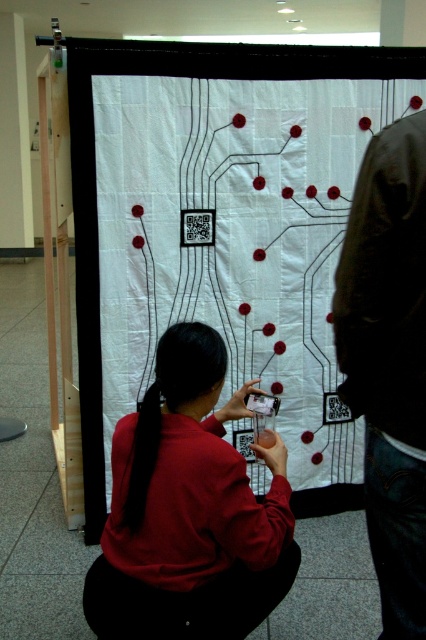
Question: Considering the real-world distances, which object is closest to the matte red shirt at center?

Choices:
 (A) dark brown leather jacket at right
 (B) white fabric circuit board at center
 (C) black silky hair at center

Answer: (C)

Question: Does white fabric circuit board at center have a greater width compared to dark brown leather jacket at right?

Choices:
 (A) yes
 (B) no

Answer: (A)

Question: Which of the following is the closest to the observer?

Choices:
 (A) (134, 269)
 (B) (423, 116)
 (C) (149, 404)
 (D) (247, 476)

Answer: (B)

Question: Is dark brown leather jacket at right further to the viewer compared to black silky hair at center?

Choices:
 (A) no
 (B) yes

Answer: (A)

Question: Among these points, which one is farthest from the camera?

Choices:
 (A) (199, 461)
 (B) (385, 632)
 (C) (233, 440)
 (D) (129, 481)

Answer: (C)

Question: Can you confirm if matte red shirt at center is thinner than dark brown leather jacket at right?

Choices:
 (A) no
 (B) yes

Answer: (A)